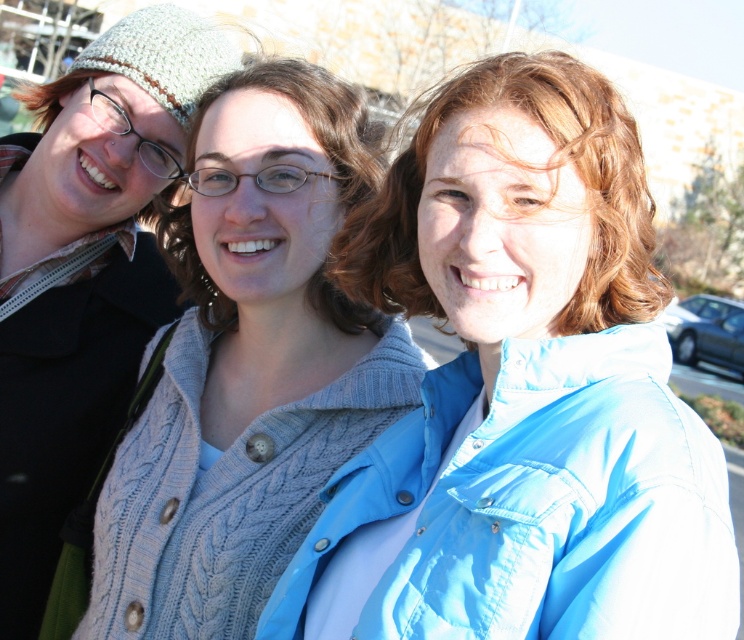
You are standing in a group photo with three people. You see a blue quilted jacket at center and a knitted gray sweater at center. Which one is positioned more to the right?

The blue quilted jacket at center is positioned more to the right than the knitted gray sweater at center.

You are standing in front of a group photo of three people. There are two points marked on the photo at coordinates point [673,502] and point [105,205]. If you want to touch the point that is nearer to you, which coordinate should you aim for?

You should aim for point [673,502] because it is closer to the viewer than point [105,205].